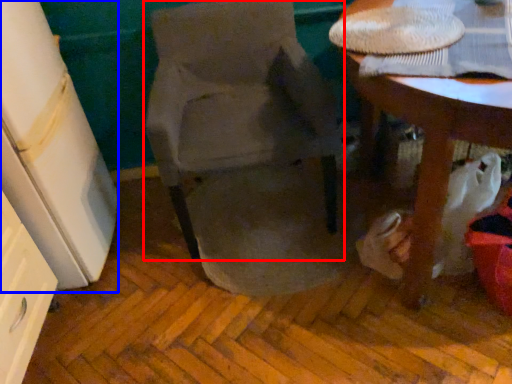
Question: Which of the following is the closest to the observer, chair (highlighted by a red box) or leftover (highlighted by a blue box)?

Choices:
 (A) chair
 (B) leftover

Answer: (B)